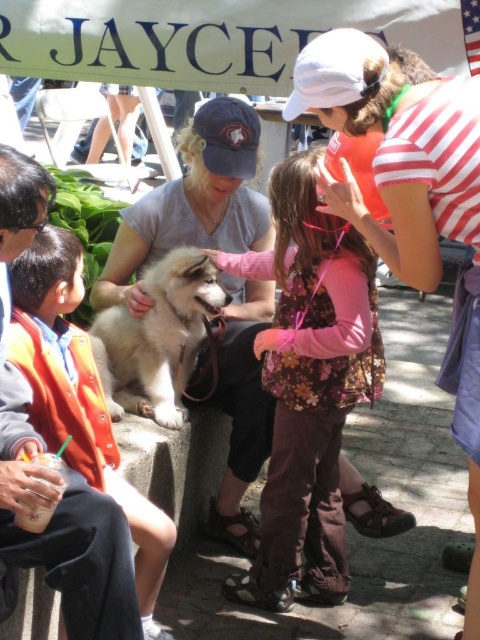
Question: Does fluffy white dog at center have a greater width compared to orange fleece vest at left?

Choices:
 (A) yes
 (B) no

Answer: (A)

Question: Which of these objects is positioned farthest from the floral fabric vest at center?

Choices:
 (A) fluffy white dog at center
 (B) orange fleece vest at left

Answer: (B)

Question: Can you confirm if floral fabric vest at center is positioned above white fluffy dog at center?

Choices:
 (A) no
 (B) yes

Answer: (A)

Question: Among these points, which one is farthest from the camera?

Choices:
 (A) (288, 544)
 (B) (88, 472)
 (C) (136, 404)
 (D) (323, 90)

Answer: (C)

Question: Is fluffy white dog at center positioned before orange fleece vest at left?

Choices:
 (A) yes
 (B) no

Answer: (B)

Question: Among these objects, which one is farthest from the camera?

Choices:
 (A) white fluffy dog at center
 (B) orange fleece vest at left
 (C) fluffy white dog at center

Answer: (A)